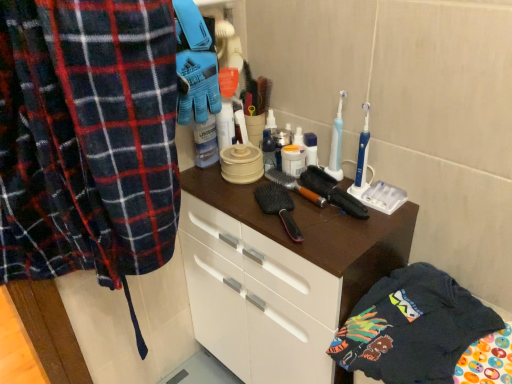
The height and width of the screenshot is (384, 512). I want to click on free space in front of brown wooden brush at center, arranged as the 1th brush when viewed from the left, so click(x=333, y=236).